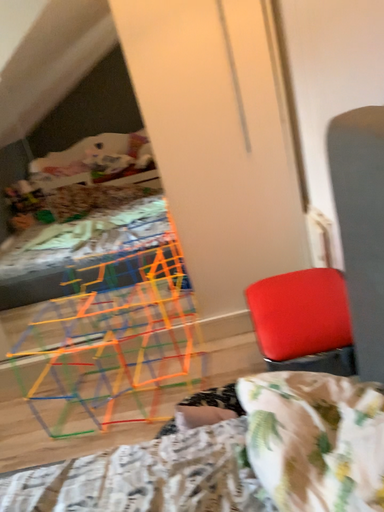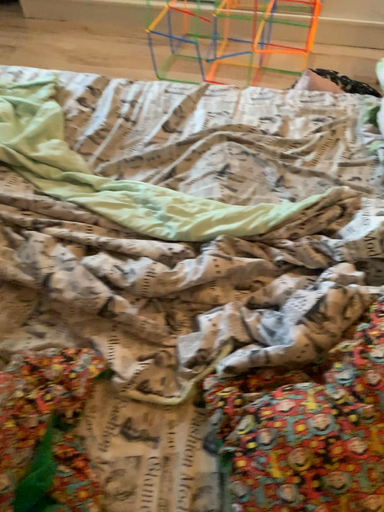
Question: How did the camera likely rotate when shooting the video?

Choices:
 (A) rotated upward
 (B) rotated downward

Answer: (B)